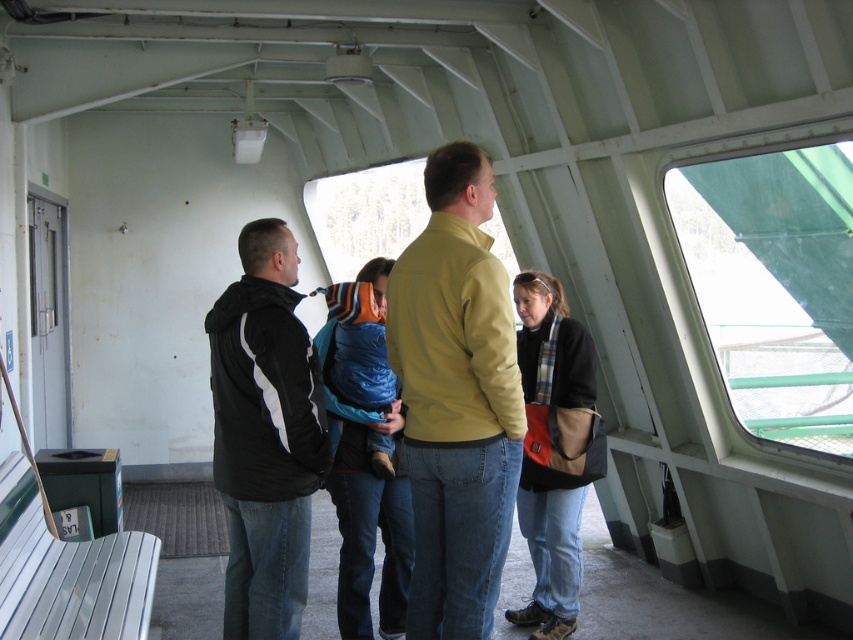
Between point (421, 337) and point (422, 416), which one is positioned behind?

Point (422, 416)

Is matte yellow jacket at center below matte yellow sweater at center?

Incorrect, matte yellow jacket at center is not positioned below matte yellow sweater at center.

Between point (408, 467) and point (426, 492), which one is positioned in front?

Point (426, 492)

Locate an element on the screen. Image resolution: width=853 pixels, height=640 pixels. matte yellow jacket at center is located at coordinates (456, 400).

Between point (230, 636) and point (532, 376), which one is positioned behind?

The point (532, 376) is more distant.

Who is positioned more to the left, black matte jacket at left or black soft fabric jacket at lower right?

From the viewer's perspective, black matte jacket at left appears more on the left side.

What do you see at coordinates (265, 435) in the screenshot? I see `black matte jacket at left` at bounding box center [265, 435].

The image size is (853, 640). Find the location of `black matte jacket at left`. black matte jacket at left is located at coordinates (265, 435).

Does matte yellow sweater at center have a lesser height compared to black soft fabric jacket at lower right?

Yes, matte yellow sweater at center is shorter than black soft fabric jacket at lower right.

Which is behind, point (457, 592) or point (541, 330)?

Positioned behind is point (541, 330).

Find the location of a particular element. Image resolution: width=853 pixels, height=640 pixels. matte yellow sweater at center is located at coordinates (456, 400).